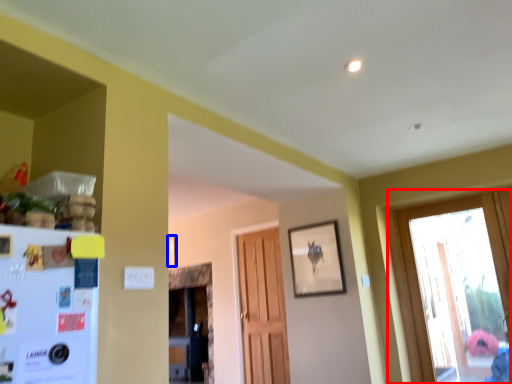
Question: Which point is closer to the camera, window (highlighted by a red box) or picture frame (highlighted by a blue box)?

Choices:
 (A) window
 (B) picture frame

Answer: (A)